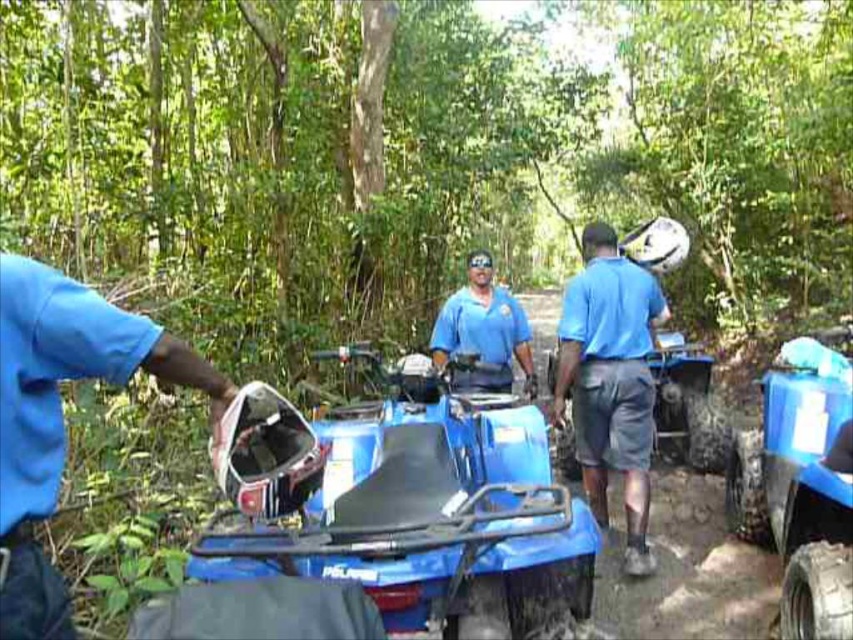
Question: In this image, where is blue matte helmet at left located relative to matte blue shirt at center?

Choices:
 (A) below
 (B) above

Answer: (A)

Question: Is blue matte helmet at left to the right of matte blue shirt at center from the viewer's perspective?

Choices:
 (A) no
 (B) yes

Answer: (A)

Question: Which point is farther to the camera?

Choices:
 (A) (315, 547)
 (B) (476, 275)
 (C) (641, 330)

Answer: (B)

Question: Which point is farther from the camera taking this photo?

Choices:
 (A) (486, 300)
 (B) (335, 416)
 (C) (18, 636)

Answer: (A)

Question: Can you confirm if blue plastic motorcycle at center is positioned to the right of matte blue shirt at center?

Choices:
 (A) no
 (B) yes

Answer: (A)

Question: Which of the following is the closest to the observer?

Choices:
 (A) (592, 317)
 (B) (378, 593)
 (C) (131, 314)
 (D) (463, 305)

Answer: (B)